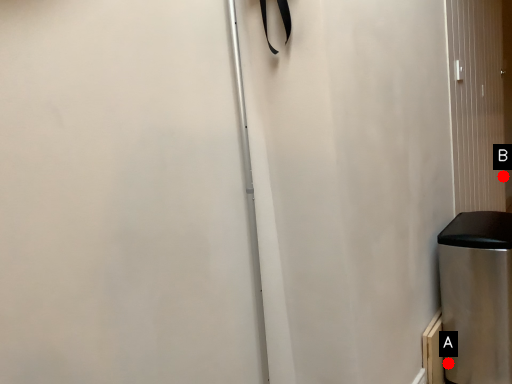
Question: Two points are circled on the image, labeled by A and B beside each circle. Among these points, which one is nearest to the camera?

Choices:
 (A) A is closer
 (B) B is closer

Answer: (A)